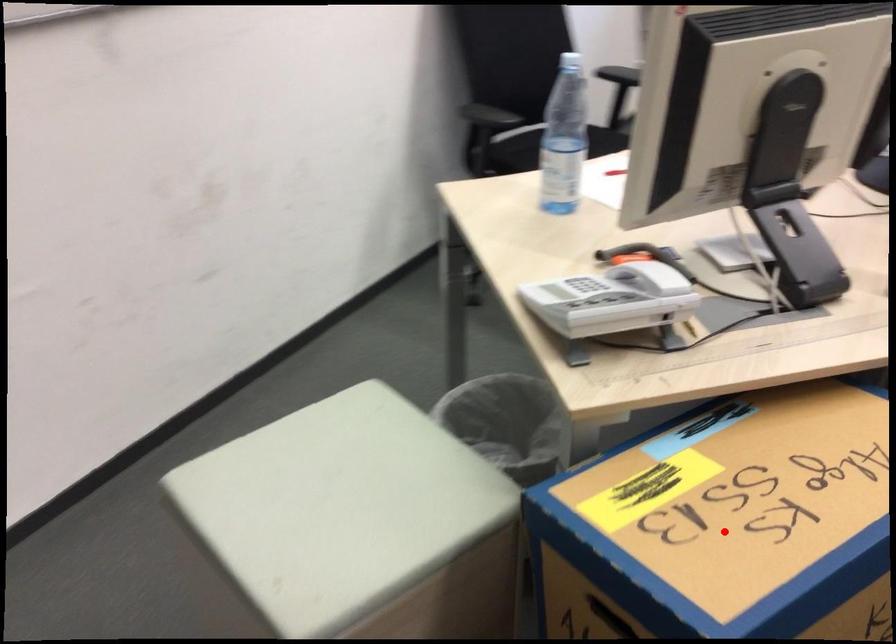
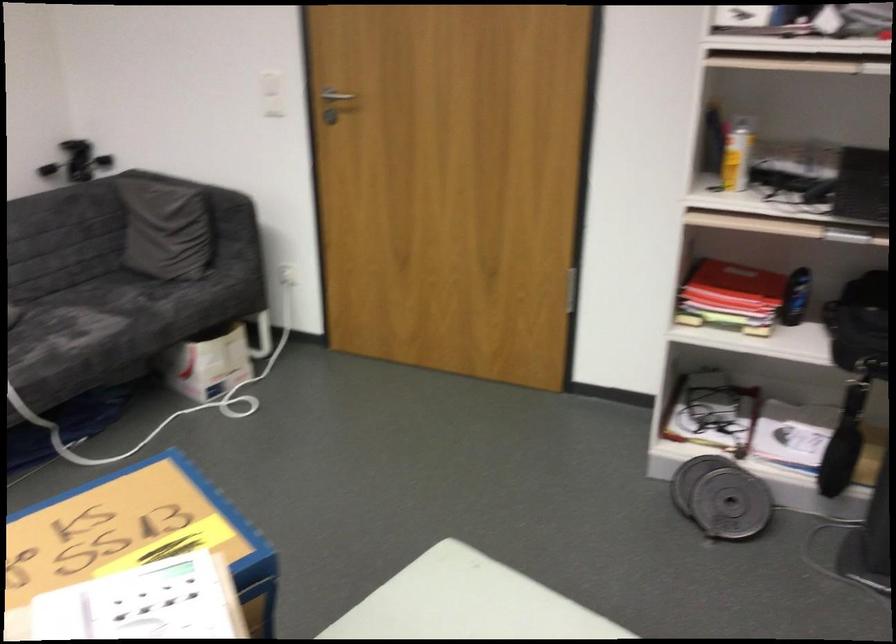
Question: I am providing you with two images of the same scene from different viewpoints. A red point is shown in image1. For the corresponding object point in image2, is it positioned nearer or farther from the camera?

Choices:
 (A) Nearer
 (B) Farther

Answer: (B)